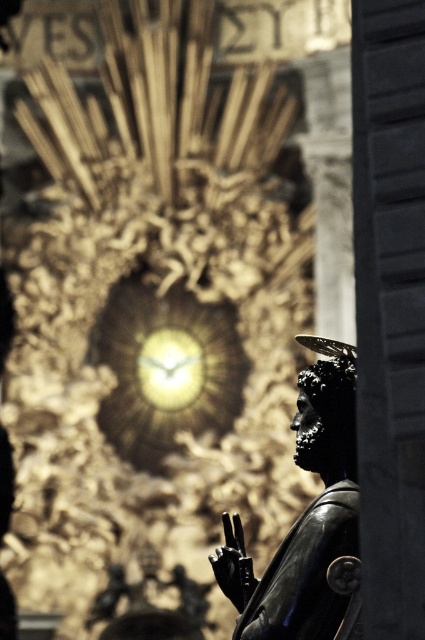
You are an art conservator assessing the placement of the polished bronze statue at lower right and the gold metallic clock at center. Based on their positions, which object is closer to the viewer?

The polished bronze statue at lower right is closer to the viewer because it is positioned below the gold metallic clock at center, indicating a lower spatial plane.

You are standing in front of a statue and want to take a photo. The statue is located at point [305,516]. Where should you position yourself to ensure the statue is centered in your photo?

To center the statue in your photo, position yourself directly in front of the point [305,516] where the polished bronze statue at lower right is located.